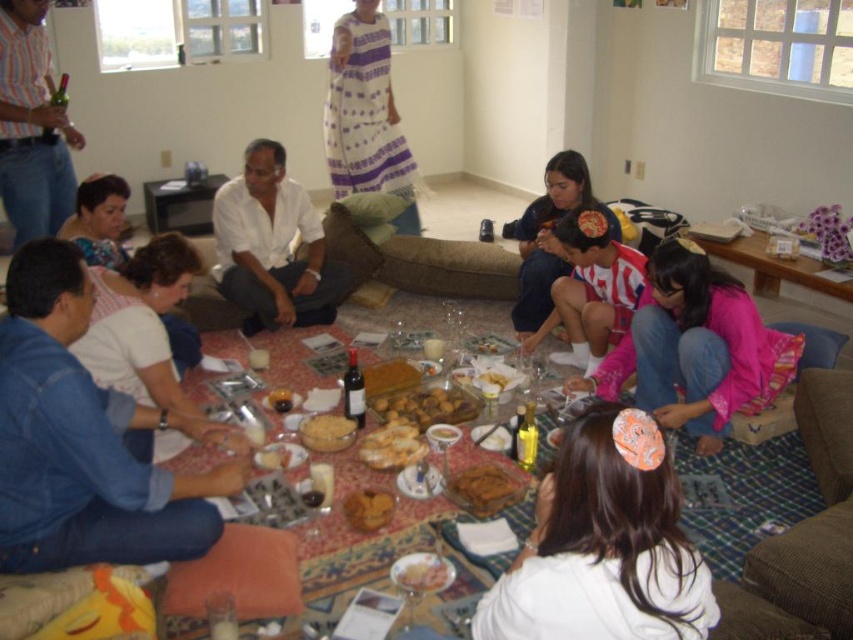
You are a photographer capturing the scene. You notice the white fabric hair clip at lower center and the white matte shirt at center. Which object is located to the right of the other?

The white fabric hair clip at lower center is positioned on the right side of white matte shirt at center.

You are organizing a photo shoot in the living room and need to place a small prop exactly at the coordinates mentioned in the scene. Where should you place the prop to ensure it aligns with the white fabric hair clip at lower center?

The white fabric hair clip at lower center is located at point 0.852 on the x axis and 0.709 on the y axis, so you should place the prop at those coordinates to align with it.

Looking at this image, you are a guest at this gathering and want to reach the golden brown crumbly bread at center. From your current position at point 0.333, 0.666, in which direction should you move to get closer to the bread?

The golden brown crumbly bread at center is located at point [483,488]. Since your current position is at [567,212], you should move towards the right and slightly downward to reach it.